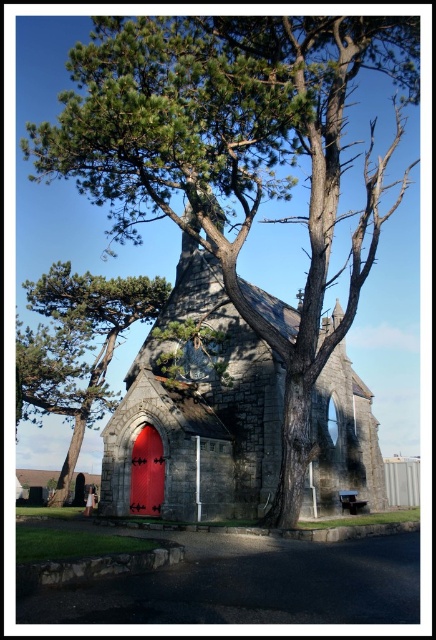
Measure the distance from green textured pine tree at upper left to stone chapel at center.

They are 58.81 feet apart.

Is green textured pine tree at upper left below stone chapel at center?

Incorrect, green textured pine tree at upper left is not positioned below stone chapel at center.

Find the location of a particular element. green textured pine tree at upper left is located at coordinates (235, 154).

Locate an element on the screen. green textured pine tree at upper left is located at coordinates (235, 154).

Between point (197, 262) and point (149, 460), which one is positioned in front?

Point (149, 460) is more forward.

Is point (245, 392) farther from camera compared to point (155, 499)?

Yes, point (245, 392) is farther from viewer.

This screenshot has width=436, height=640. I want to click on stone chapel at center, so click(x=200, y=406).

Which is above, stone chapel at center or green textured pine tree at center?

stone chapel at center is above.

Is stone chapel at center smaller than green textured pine tree at center?

No.

Is point (272, 296) less distant than point (112, 390)?

No, (272, 296) is behind (112, 390).

You are a GUI agent. You are given a task and a screenshot of the screen. Output one action in this format:
    pyautogui.click(x=<x>, y=<y>)
    Task: Click on the stone chapel at center
    
    Given the screenshot: What is the action you would take?
    pyautogui.click(x=200, y=406)